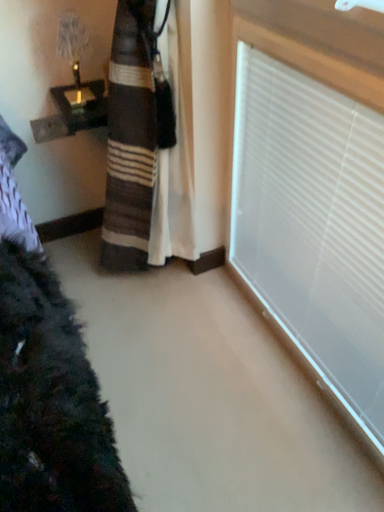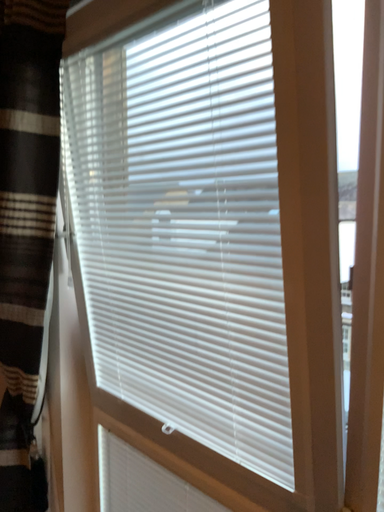
Question: Which way did the camera rotate in the video?

Choices:
 (A) rotated left
 (B) rotated right

Answer: (B)